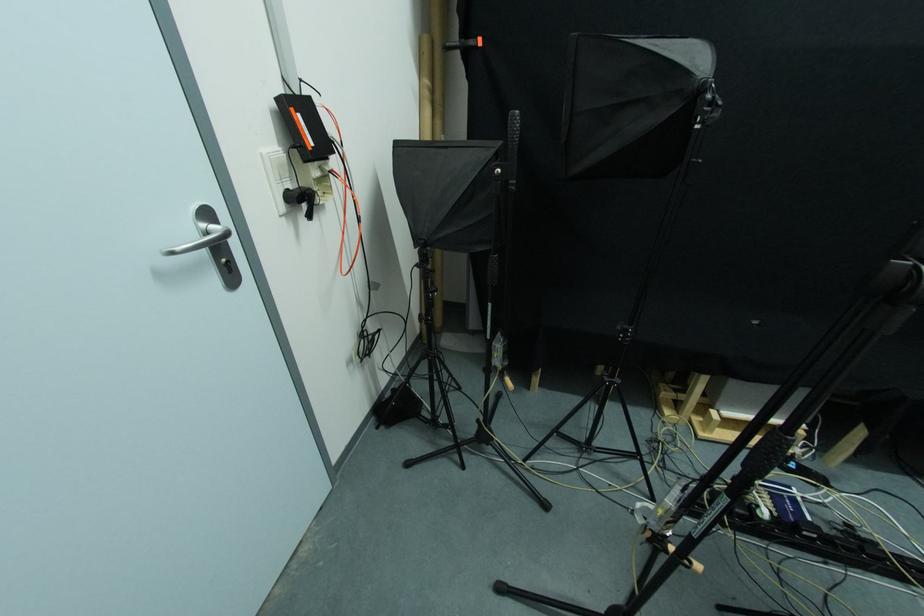
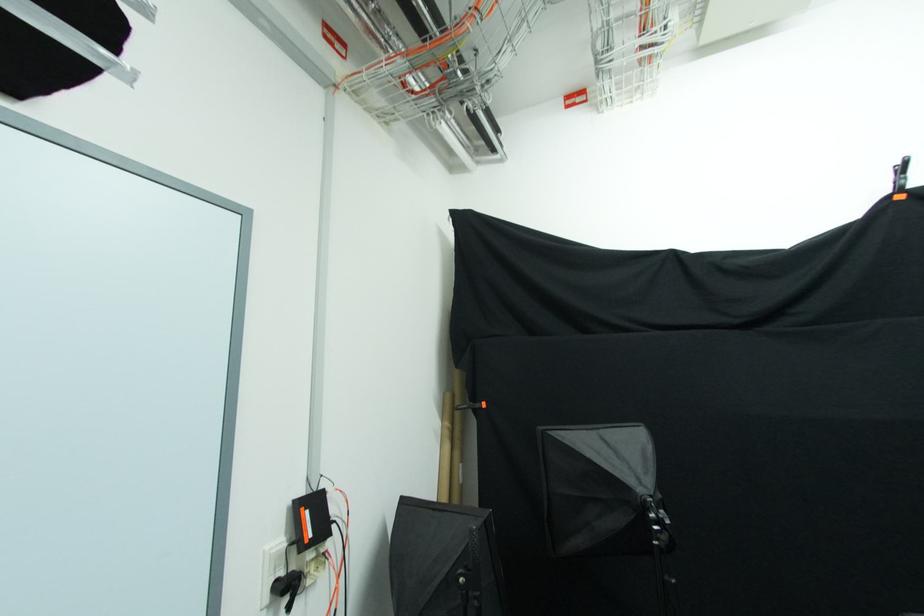
Find the pixel in the second image that matches [429,84] in the first image.

(448, 427)